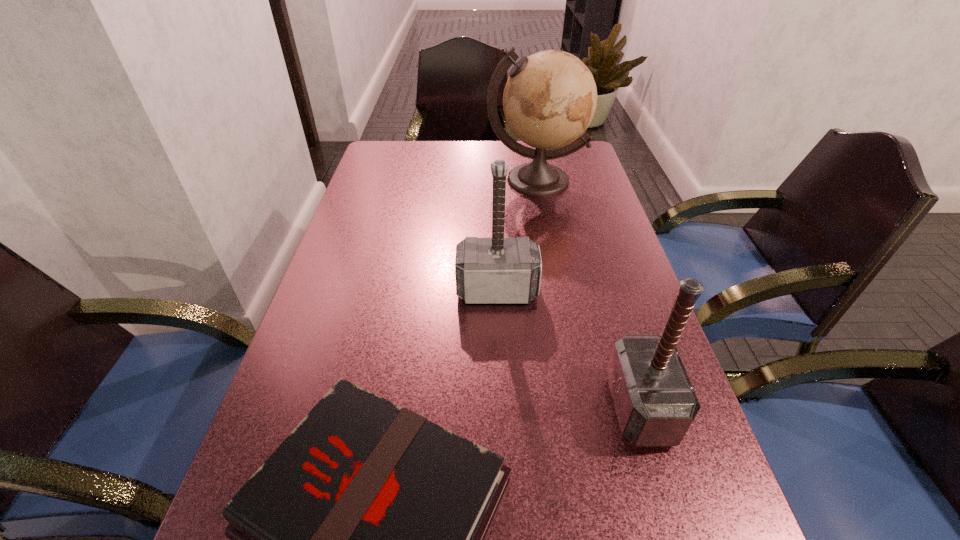
Where is `globe`? This screenshot has width=960, height=540. globe is located at coordinates (550, 98).

Image resolution: width=960 pixels, height=540 pixels. What are the coordinates of `the farthest object` in the screenshot? It's located at (550, 98).

Image resolution: width=960 pixels, height=540 pixels. What are the coordinates of `the left hammer` in the screenshot? It's located at (488, 270).

This screenshot has height=540, width=960. In order to click on the farther hammer in this screenshot , I will do `click(488, 270)`.

Identify the location of the nearer hammer. The height and width of the screenshot is (540, 960). (655, 403).

Where is `vacant space located on the front-facing side of the globe`? The image size is (960, 540). vacant space located on the front-facing side of the globe is located at coordinates (545, 228).

Find the location of a particular element. The image size is (960, 540). free point located for striking with the head of the left hammer is located at coordinates (503, 446).

Where is `vacant space located 0.080m on the front of the right hammer`? vacant space located 0.080m on the front of the right hammer is located at coordinates (669, 501).

I want to click on object that is at the far edge, so click(550, 98).

You are a GUI agent. You are given a task and a screenshot of the screen. Output one action in this format:
    pyautogui.click(x=<x>, y=<y>)
    Task: Click on the globe at the right edge
    Image resolution: width=960 pixels, height=540 pixels.
    Given the screenshot: What is the action you would take?
    pyautogui.click(x=550, y=98)